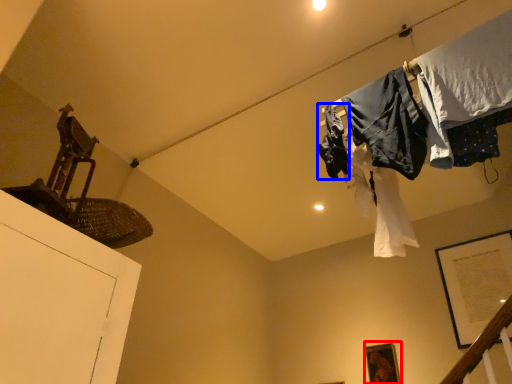
Question: Which object appears closest to the camera in this image, picture frame (highlighted by a red box) or clothing (highlighted by a blue box)?

Choices:
 (A) picture frame
 (B) clothing

Answer: (B)